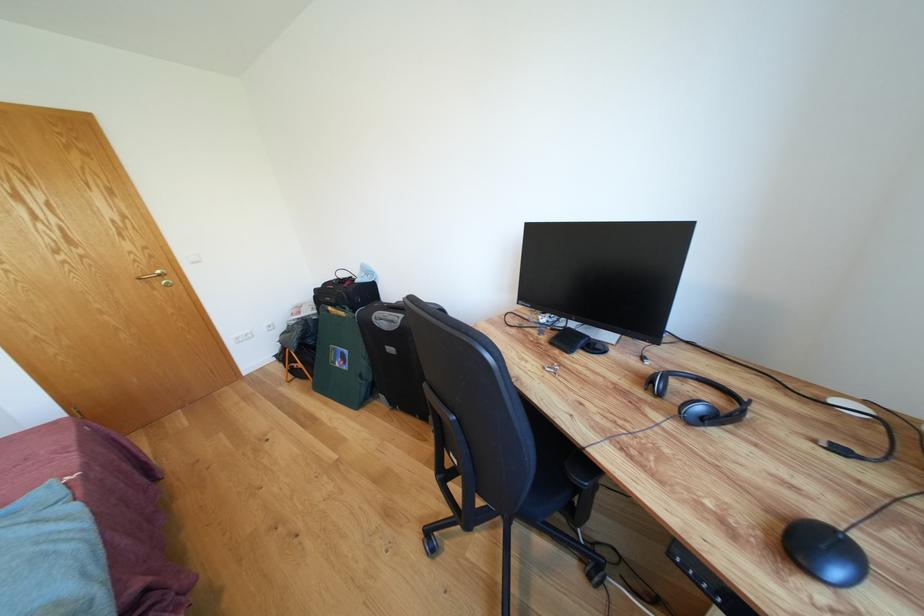
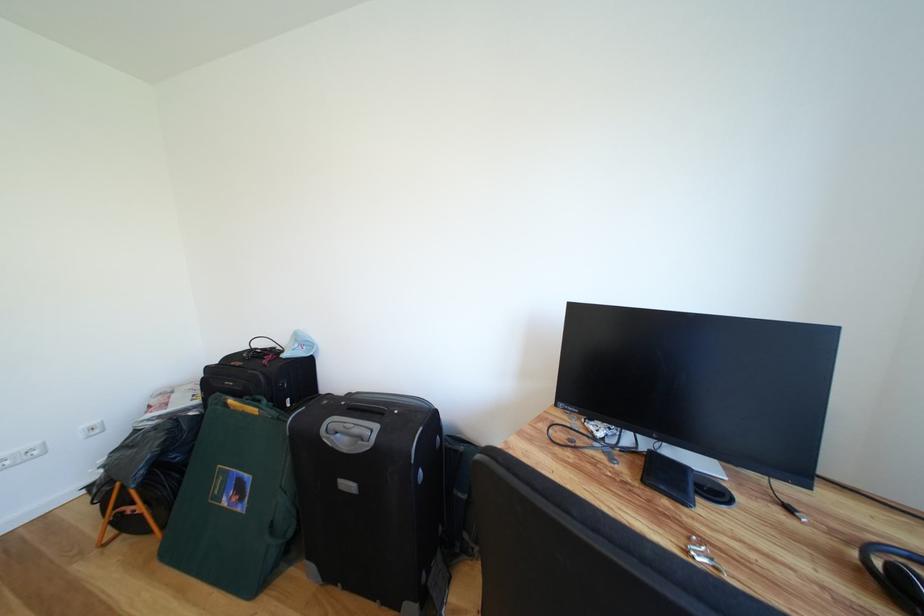
Question: Based on the continuous images, in which direction is the camera rotating? Reply with the corresponding letter.

Choices:
 (A) Left
 (B) Right
 (C) Up
 (D) Down

Answer: (B)